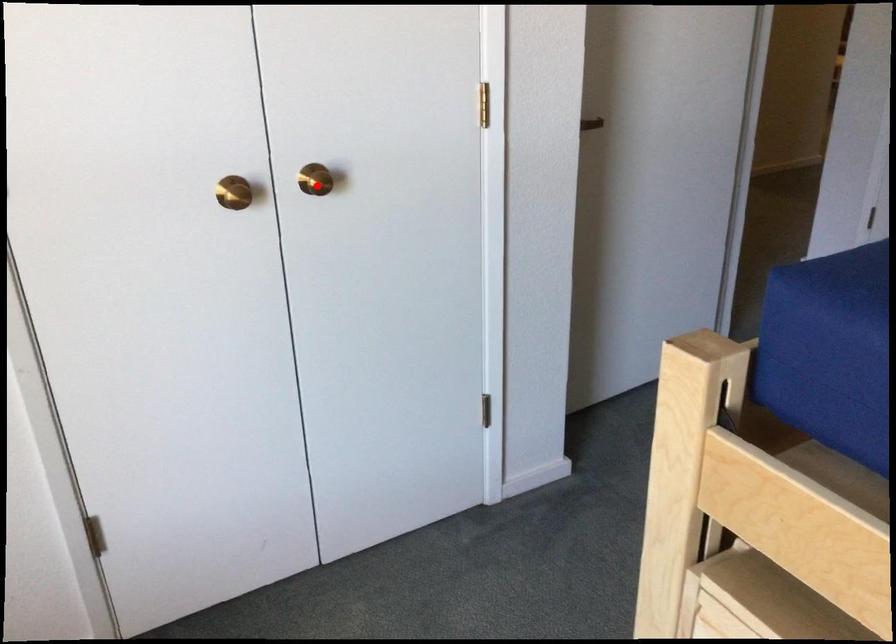
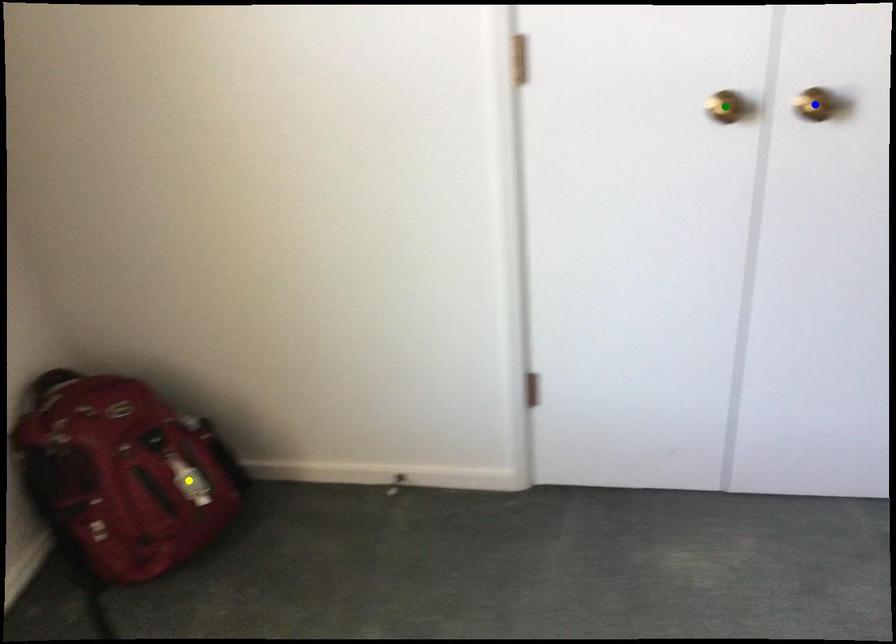
Question: I am providing you with two images of the same scene from different viewpoints. A red point is marked on the first image. You are given multiple points on the second image. Which spot in image 2 lines up with the point in image 1?

Choices:
 (A) blue point
 (B) green point
 (C) yellow point

Answer: (A)